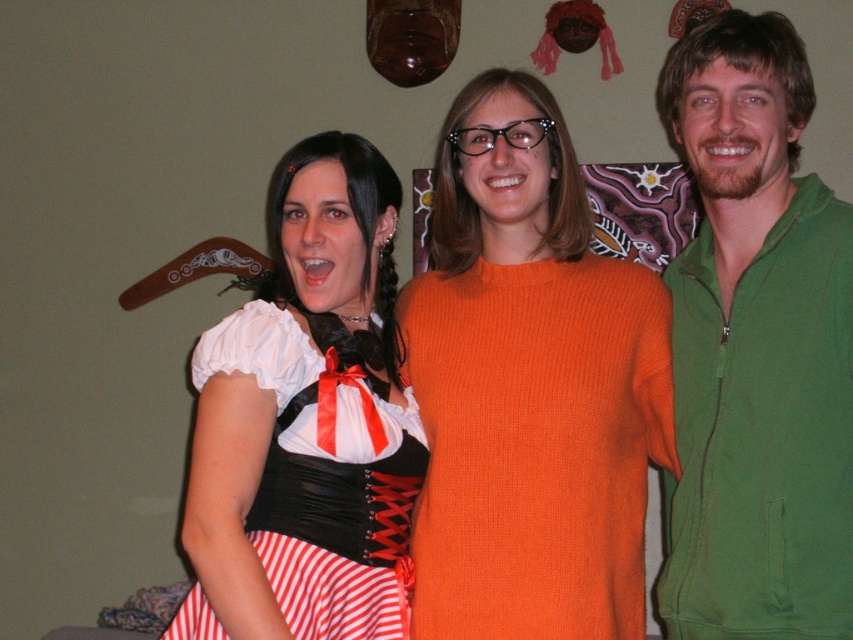
Question: Which of the following is the closest to the observer?

Choices:
 (A) (598, 508)
 (B) (757, 172)

Answer: (B)

Question: Is green zip-up hoodie at right closer to camera compared to matte black corset at center?

Choices:
 (A) no
 (B) yes

Answer: (A)

Question: In this image, where is orange knitted sweater at center located relative to matte black corset at center?

Choices:
 (A) left
 (B) right

Answer: (B)

Question: Estimate the real-world distances between objects in this image. Which object is closer to the green zip-up hoodie at right?

Choices:
 (A) orange knitted sweater at center
 (B) matte black corset at center

Answer: (A)

Question: Is green zip-up hoodie at right behind matte black corset at center?

Choices:
 (A) no
 (B) yes

Answer: (B)

Question: Among these objects, which one is farthest from the camera?

Choices:
 (A) matte black corset at center
 (B) green zip-up hoodie at right
 (C) orange knitted sweater at center

Answer: (C)